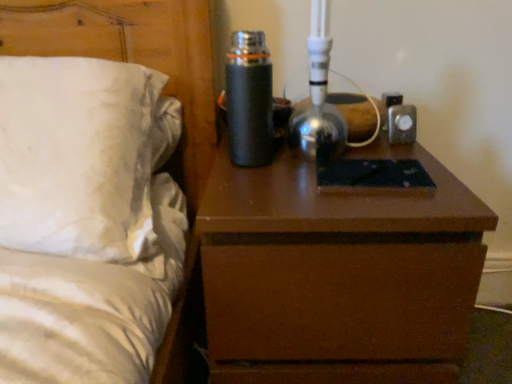
Identify the location of free space above brown matte nightstand at center (from a real-world perspective). (343, 165).